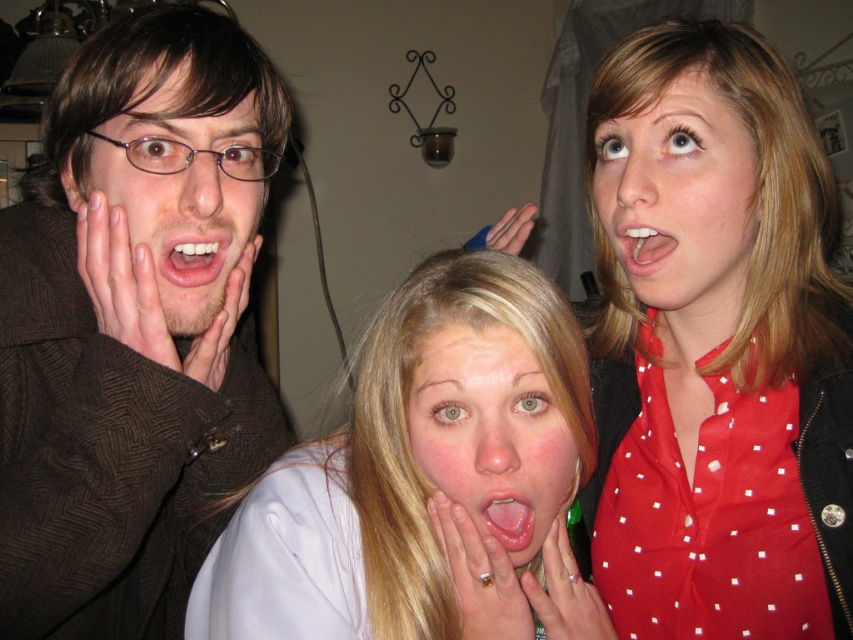
Question: Is red dotted shirt at upper right above matte blue hand at center?

Choices:
 (A) no
 (B) yes

Answer: (A)

Question: Among these objects, which one is nearest to the camera?

Choices:
 (A) smooth red blouse at upper right
 (B) pink glossy tongue at center
 (C) pink flesh-toned hand at left
 (D) matte brown hair at center

Answer: (B)

Question: Is matte white hand at center smaller than smooth white teeth at center?

Choices:
 (A) no
 (B) yes

Answer: (A)

Question: Considering the real-world distances, which object is closest to the brown textured jacket at left?

Choices:
 (A) white glossy teeth at center
 (B) pink flesh-toned hand at left
 (C) smooth white teeth at center
 (D) red dotted shirt at upper right

Answer: (B)

Question: Which point is farther to the camera?

Choices:
 (A) [x=558, y=442]
 (B) [x=848, y=353]
 (C) [x=422, y=332]

Answer: (B)

Question: Is white matte ring at lower center thinner than white glossy teeth at center?

Choices:
 (A) no
 (B) yes

Answer: (A)